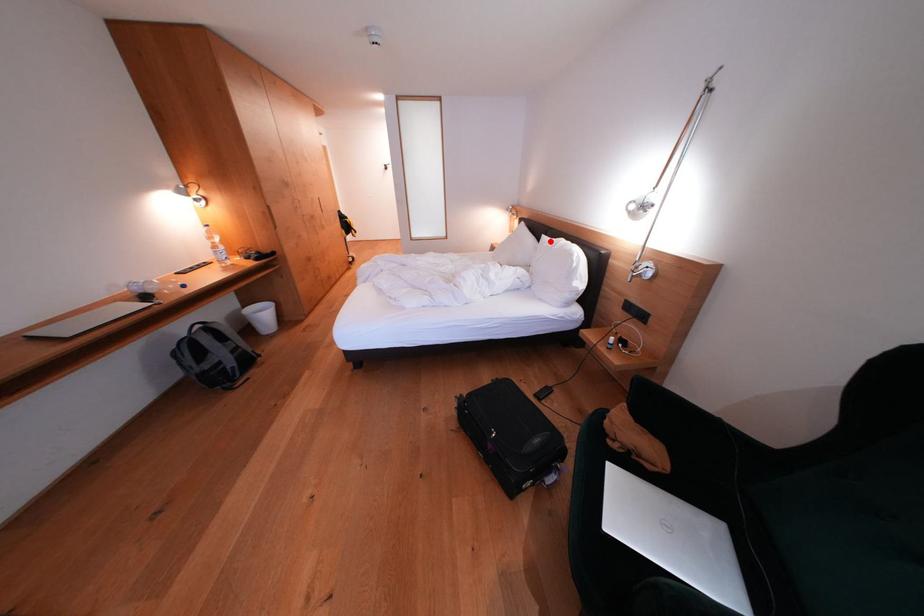
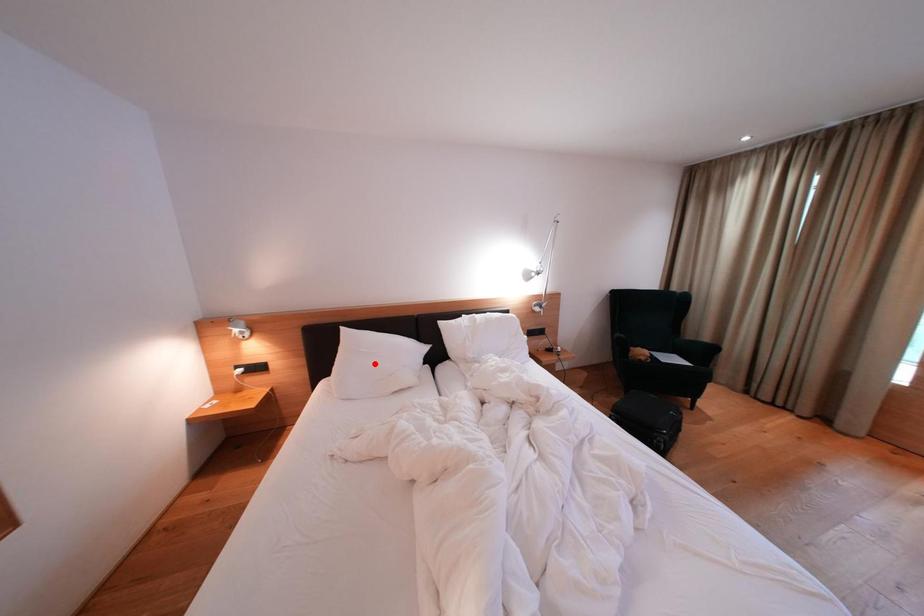
I am providing you with two images of the same scene from different viewpoints. A red point is marked on the first image and another point is marked on the second image. Does the point marked in image1 correspond to the same location as the one in image2?

No